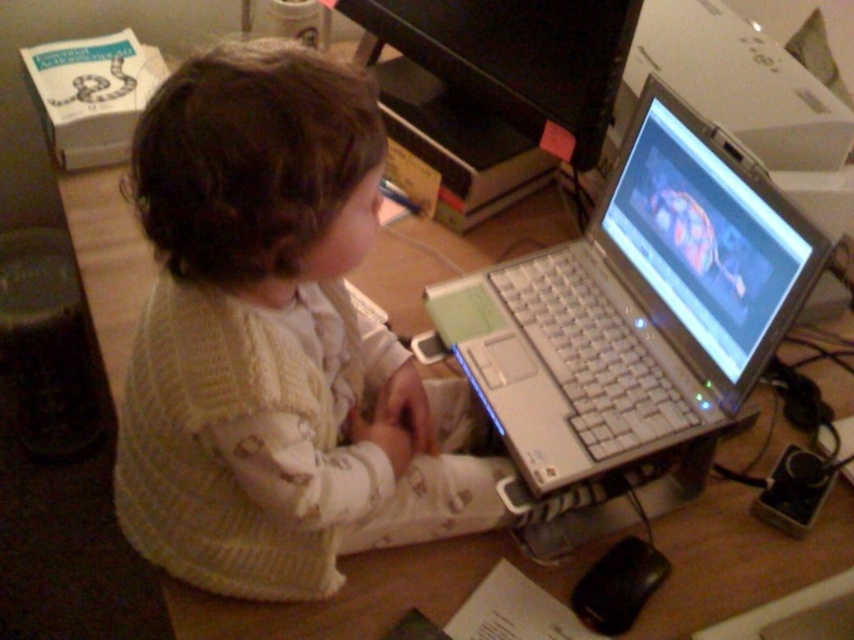
Which is below, white knitted sweater at center or silver metallic laptop at center?

white knitted sweater at center

Is point (354, 148) in front of point (616, 292)?

That is True.

Describe the element at coordinates (275, 340) in the screenshot. I see `white knitted sweater at center` at that location.

Where is `white knitted sweater at center`? The image size is (854, 640). white knitted sweater at center is located at coordinates tap(275, 340).